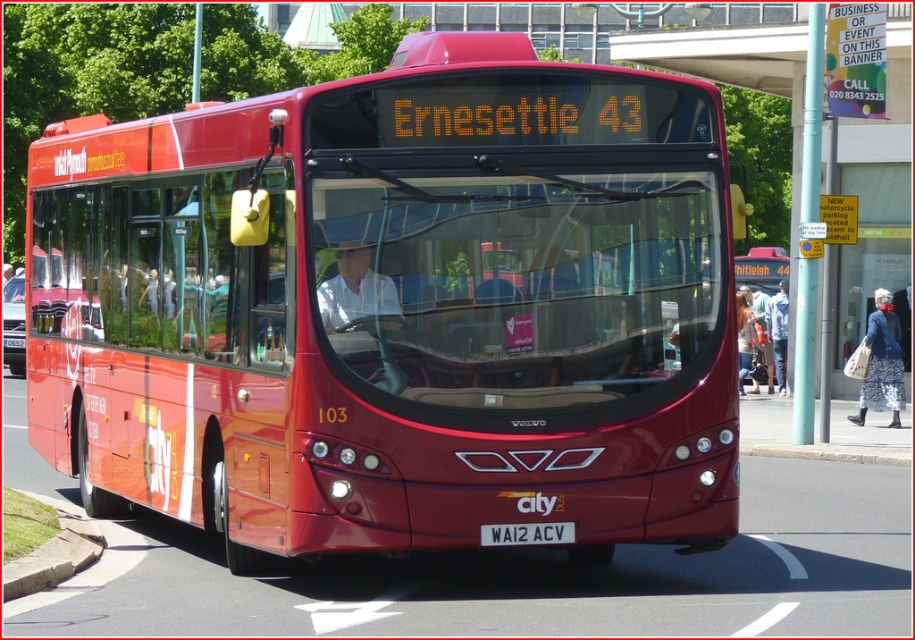
Question: Which of the following is the closest to the observer?

Choices:
 (A) matte red bus at center
 (B) white plastic license plate at center

Answer: (B)

Question: Which point is closer to the camera taking this photo?

Choices:
 (A) (264, 442)
 (B) (544, 536)

Answer: (B)

Question: Is floral fabric dress at lower right further to camera compared to white plastic license plate at center?

Choices:
 (A) no
 (B) yes

Answer: (B)

Question: Which object is closer to the camera taking this photo?

Choices:
 (A) floral fabric dress at lower right
 (B) matte red bus at center

Answer: (B)

Question: Is floral fabric dress at lower right in front of white plastic license plate at center?

Choices:
 (A) yes
 (B) no

Answer: (B)

Question: Is matte red bus at center smaller than white plastic license plate at center?

Choices:
 (A) no
 (B) yes

Answer: (A)